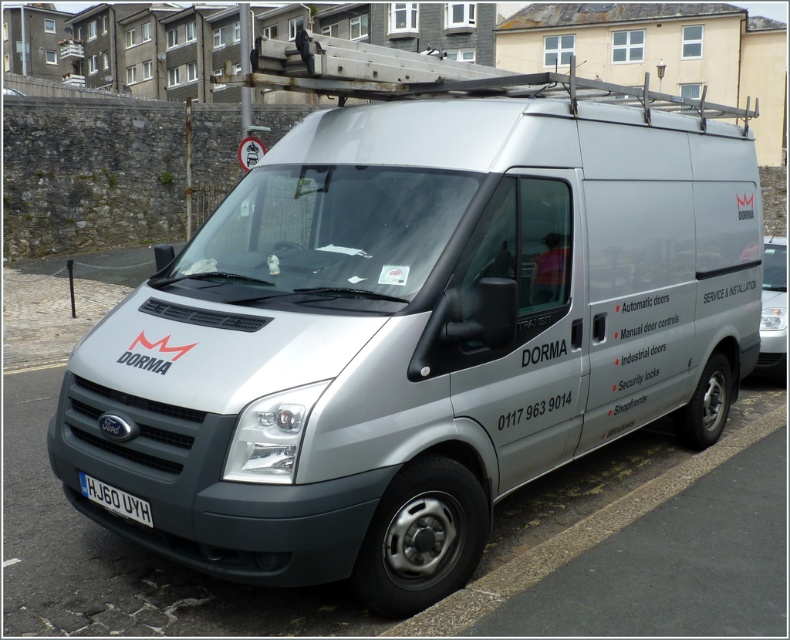
Which is in front, point (442, 630) or point (126, 493)?

Point (442, 630) is in front.

Does gray asphalt curb at lower right appear on the left side of white plastic license plate at lower center?

Incorrect, gray asphalt curb at lower right is not on the left side of white plastic license plate at lower center.

Does point (589, 545) come in front of point (141, 516)?

No, (589, 545) is further to viewer.

At what (x,y) coordinates should I click in order to perform the action: click on gray asphalt curb at lower right. Please return your answer as a coordinate pair (x, y). This screenshot has width=790, height=640. Looking at the image, I should click on (576, 538).